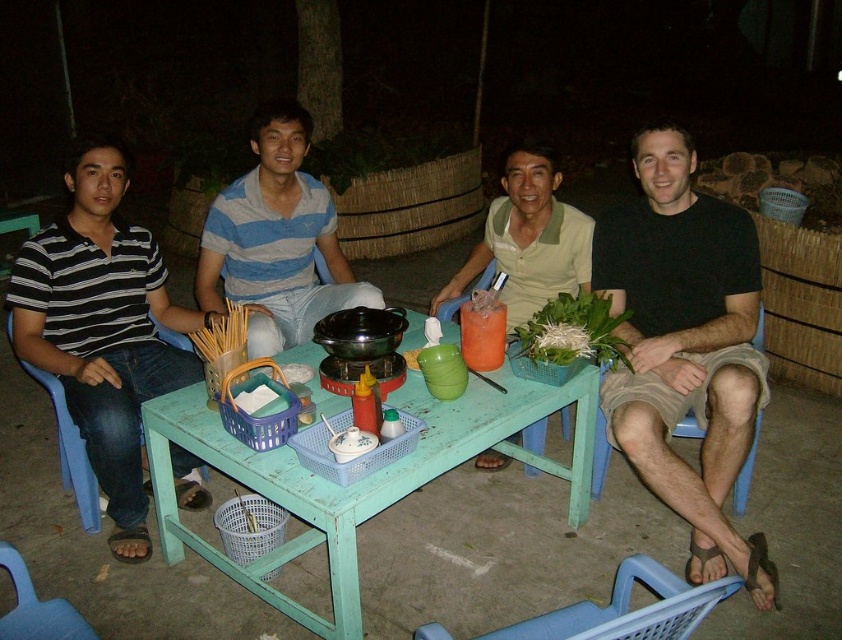
You are a photographer trying to capture a closeup of the black striped shirt at left and the green painted wood table at center. Which object should you focus on first to ensure it appears sharp in your photo?

The black striped shirt at left is closer to the viewer than the green painted wood table at center, so you should focus on the black striped shirt at left first to ensure it appears sharp.

You are sitting at the green painted wood table at center and want to pass a napkin to the person wearing the black striped shirt at left. In which direction should you pass it?

The black striped shirt at left is positioned on the left side of the green painted wood table at center, so you should pass the napkin to the left.